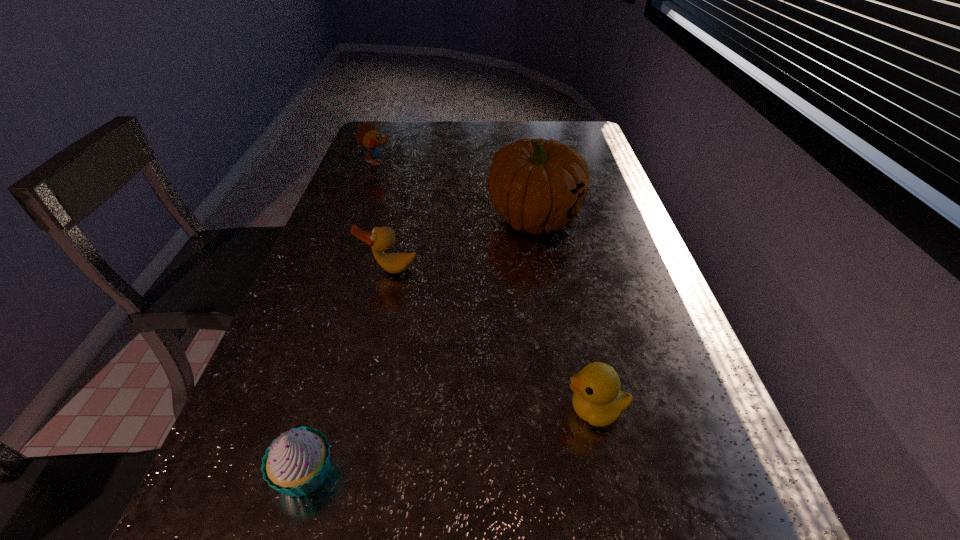
Identify the location of blank region between the rightmost duck and the tallest object. Image resolution: width=960 pixels, height=540 pixels. (565, 314).

This screenshot has height=540, width=960. What are the coordinates of `object that can be found as the closest to the second farthest object` in the screenshot? It's located at (380, 239).

Locate an element on the screen. object that is the fourth closest to the second nearest object is located at coordinates (368, 135).

What are the coordinates of `the second closest duck to the rightmost duck` in the screenshot? It's located at (368, 135).

Where is `the closest duck relative to the tallest object`? The image size is (960, 540). the closest duck relative to the tallest object is located at coordinates (380, 239).

I want to click on vacant space that satisfies the following two spatial constraints: 1. on the back side of the cupcake; 2. on the front-facing side of the farthest duck, so click(x=396, y=163).